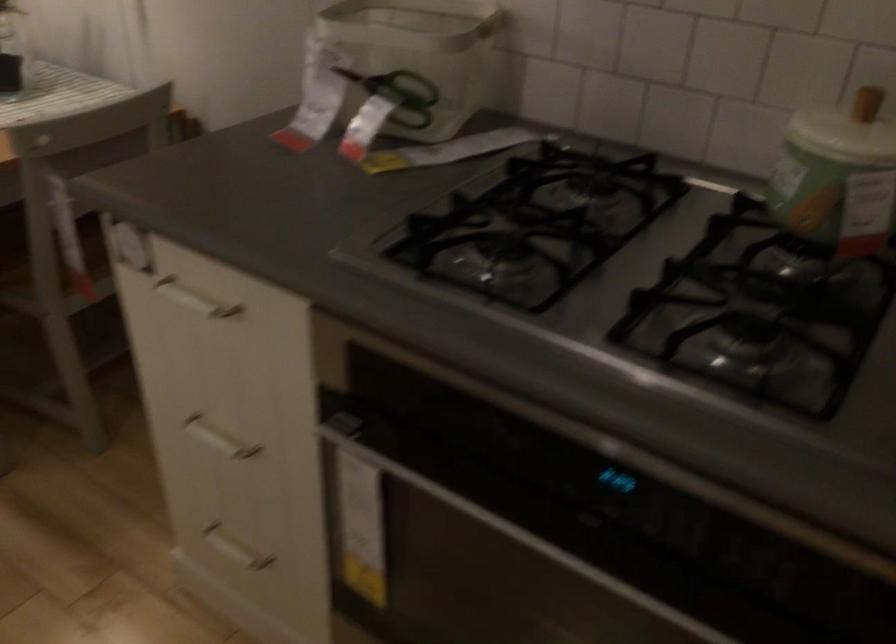
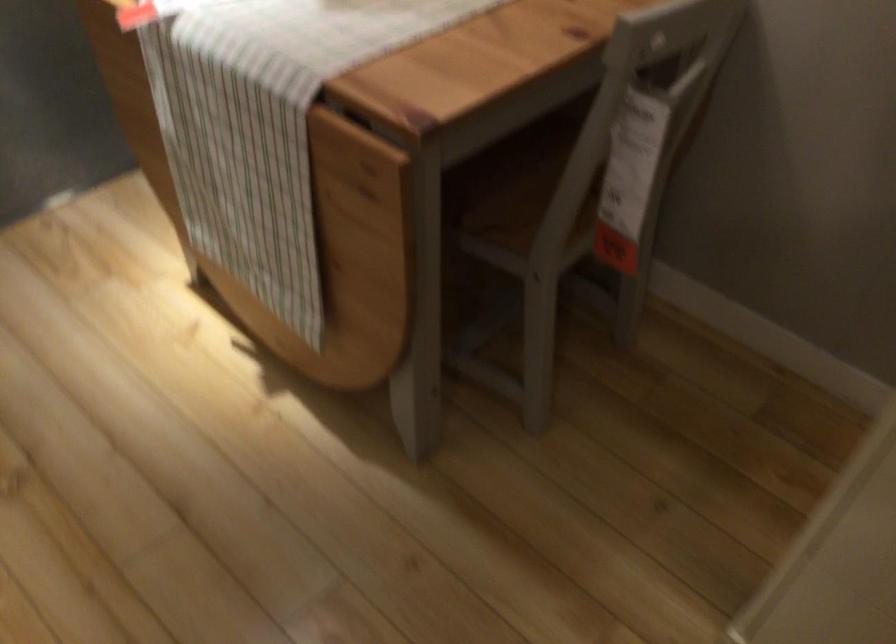
Which direction would the cameraman need to move to produce the second image?

The cameraman walked toward left, forward.